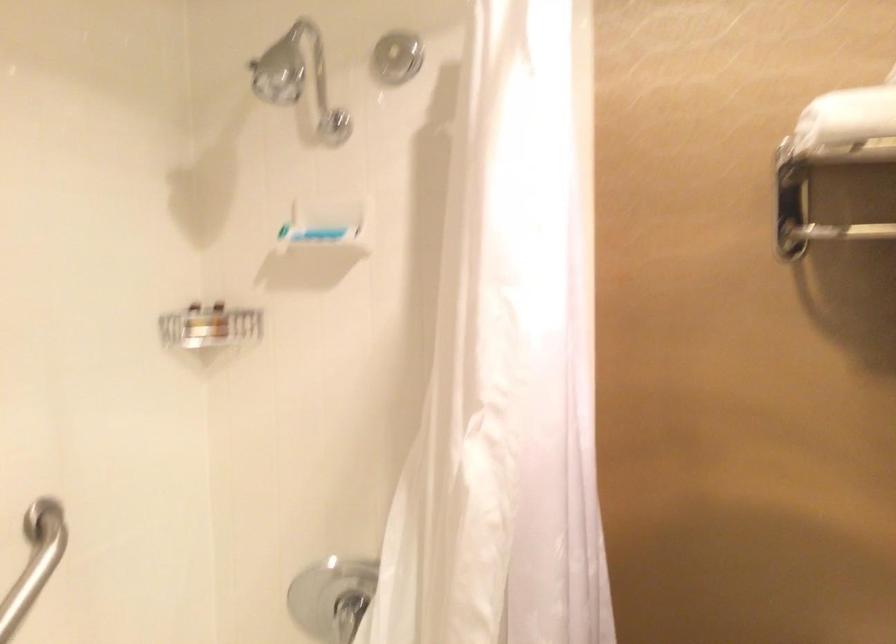
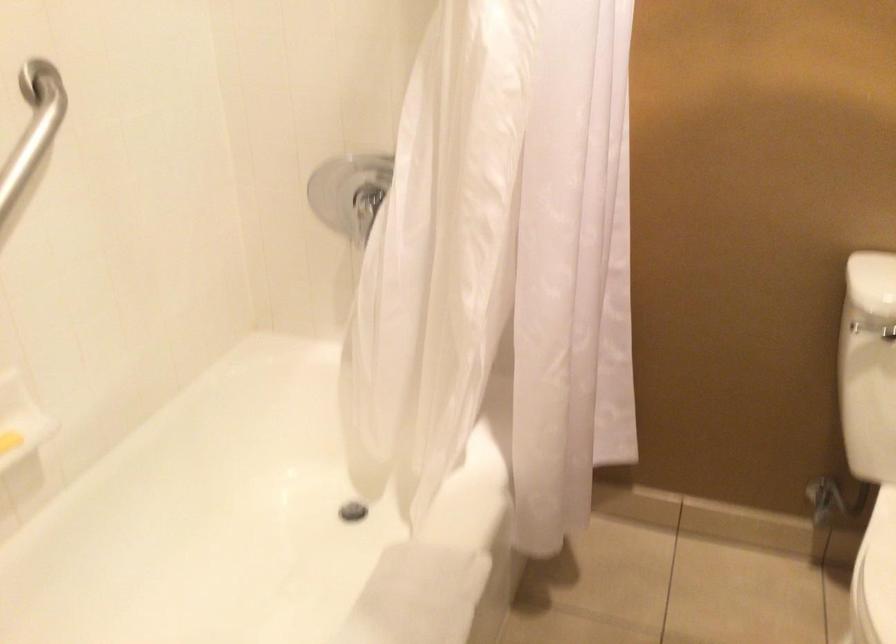
In a continuous first-person perspective shot, in which direction is the camera moving?

The movement direction of the cameraman is right, forward.